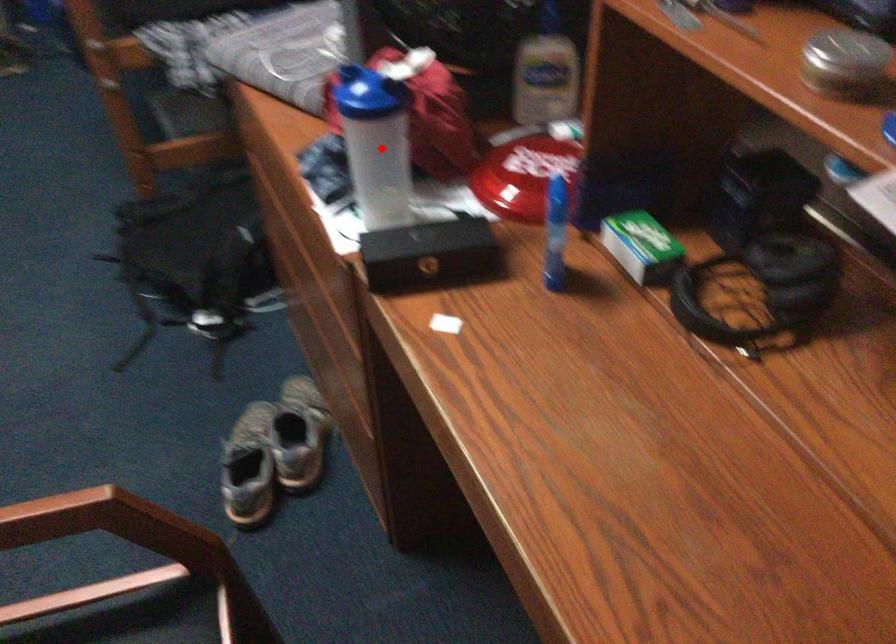
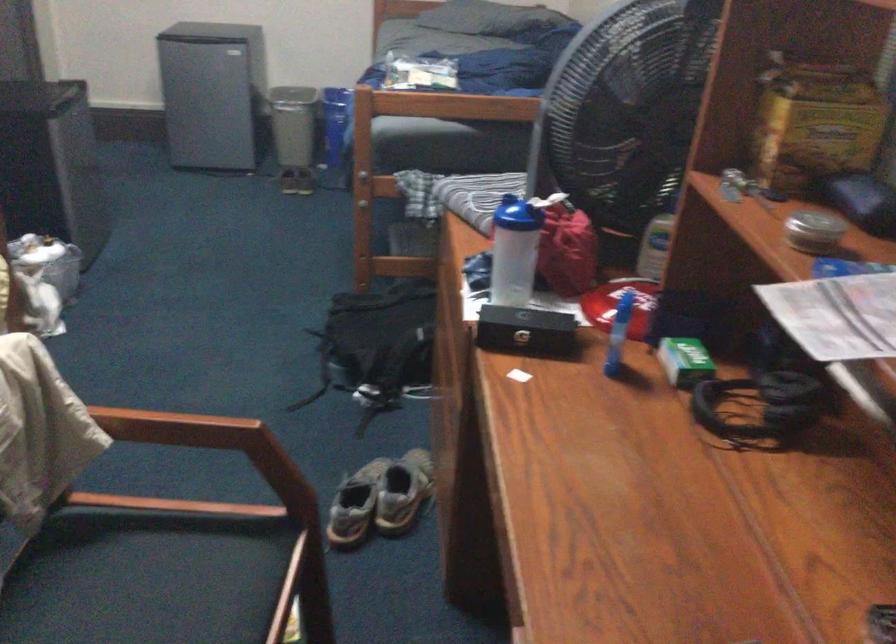
Question: I am providing you with two images of the same scene from different viewpoints. A red point is marked on the first image. Is the red point's position out of view in image 2?

Choices:
 (A) Yes
 (B) No

Answer: (B)